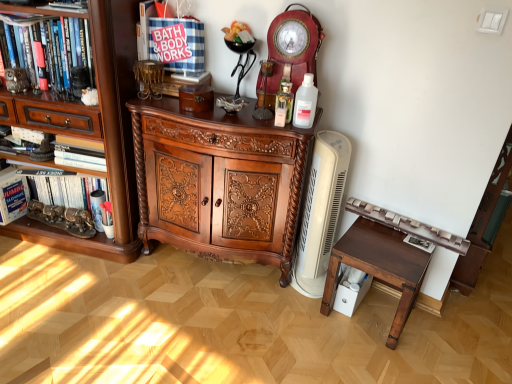
Question: Is clear plastic bottle at center facing away from hardcover book at left, the 1th book when ordered from right to left?

Choices:
 (A) no
 (B) yes

Answer: (A)

Question: Does clear plastic bottle at center appear on the left side of hardcover book at left, which ranks as the second book in left-to-right order?

Choices:
 (A) no
 (B) yes

Answer: (A)

Question: Does clear plastic bottle at center lie in front of hardcover book at left, the 1th book when ordered from right to left?

Choices:
 (A) no
 (B) yes

Answer: (B)

Question: Is clear plastic bottle at center not within hardcover book at left, which ranks as the second book in left-to-right order?

Choices:
 (A) yes
 (B) no

Answer: (A)

Question: Could hardcover book at left, the 1th book when ordered from right to left, be considered to be inside clear plastic bottle at center?

Choices:
 (A) no
 (B) yes

Answer: (A)

Question: Does point (308, 94) appear closer or farther from the camera than point (295, 175)?

Choices:
 (A) farther
 (B) closer

Answer: (B)

Question: From a real-world perspective, is clear plastic bottle at center positioned above or below dark wood carved cabinet at center?

Choices:
 (A) below
 (B) above

Answer: (B)

Question: Visually, is clear plastic bottle at center positioned to the left or to the right of dark wood carved cabinet at center?

Choices:
 (A) right
 (B) left

Answer: (A)

Question: Based on their sizes in the image, would you say clear plastic bottle at center is bigger or smaller than dark wood carved cabinet at center?

Choices:
 (A) small
 (B) big

Answer: (A)

Question: From the image's perspective, is brown wood bookshelf at left above or below white cardboard box at left, which is the 1th book from left to right?

Choices:
 (A) above
 (B) below

Answer: (A)

Question: Is point (28, 34) closer or farther from the camera than point (6, 201)?

Choices:
 (A) closer
 (B) farther

Answer: (A)

Question: Is brown wood bookshelf at left bigger or smaller than white cardboard box at left, acting as the 2th book starting from the right?

Choices:
 (A) big
 (B) small

Answer: (A)

Question: Considering the positions of brown wood bookshelf at left and white cardboard box at left, which is the 1th book from left to right, in the image, is brown wood bookshelf at left taller or shorter than white cardboard box at left, which is the 1th book from left to right,?

Choices:
 (A) short
 (B) tall

Answer: (B)

Question: In the image, is dark wood carved cabinet at center positioned in front of or behind brown wood cabinet at left?

Choices:
 (A) front
 (B) behind

Answer: (B)

Question: Does point coord(282,274) appear closer or farther from the camera than point coord(116,0)?

Choices:
 (A) closer
 (B) farther

Answer: (B)